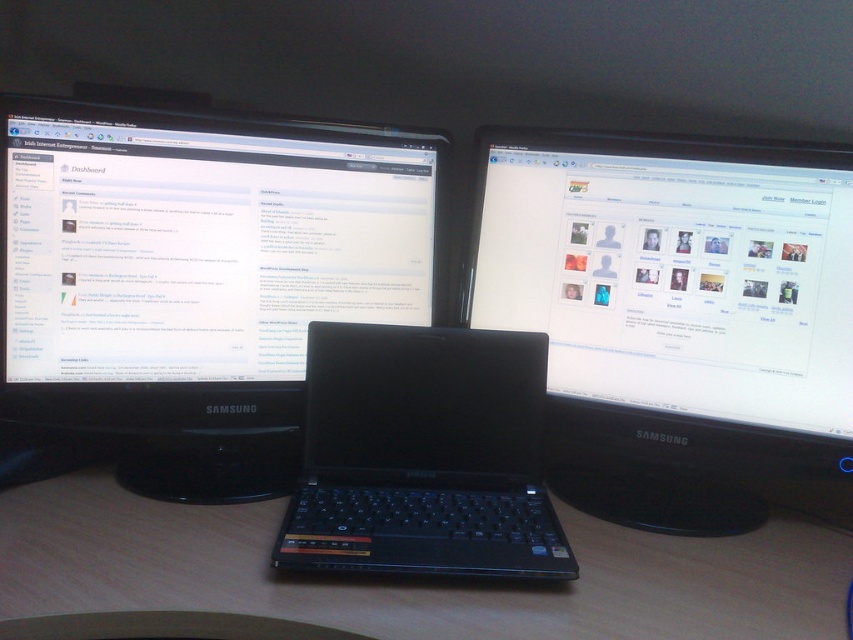
Does black glossy monitor at upper left lie in front of black plastic laptop at center?

That is False.

Is point (112, 211) less distant than point (544, 538)?

No, (112, 211) is further to viewer.

Is point (216, 282) positioned before point (450, 420)?

No, it is behind (450, 420).

You are a GUI agent. You are given a task and a screenshot of the screen. Output one action in this format:
    pyautogui.click(x=<x>, y=<y>)
    Task: Click on the black glossy monitor at upper left
    The image size is (853, 640).
    Given the screenshot: What is the action you would take?
    pyautogui.click(x=199, y=276)

Who is taller, black glossy monitor at upper left or wooden at center?

Standing taller between the two is black glossy monitor at upper left.

You are a GUI agent. You are given a task and a screenshot of the screen. Output one action in this format:
    pyautogui.click(x=<x>, y=<y>)
    Task: Click on the black glossy monitor at upper left
    This screenshot has height=640, width=853.
    Given the screenshot: What is the action you would take?
    pyautogui.click(x=199, y=276)

Does matte black monitor at center have a lesser width compared to wooden at center?

Indeed, matte black monitor at center has a lesser width compared to wooden at center.

Does matte black monitor at center lie in front of wooden at center?

No.

At what (x,y) coordinates should I click in order to perform the action: click on matte black monitor at center. Please return your answer as a coordinate pair (x, y). The width and height of the screenshot is (853, 640). Looking at the image, I should click on (672, 314).

Locate an element on the screen. The image size is (853, 640). matte black monitor at center is located at coordinates (672, 314).